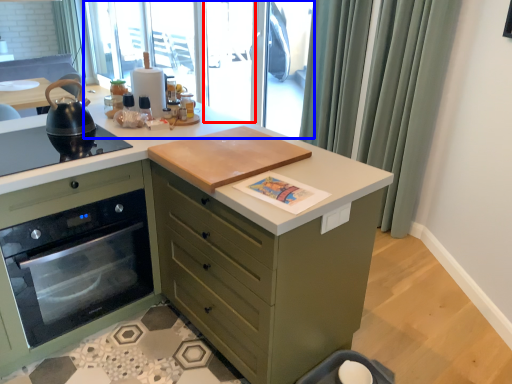
Question: Which point is further to the camera, screen door (highlighted by a red box) or window screen (highlighted by a blue box)?

Choices:
 (A) screen door
 (B) window screen

Answer: (A)